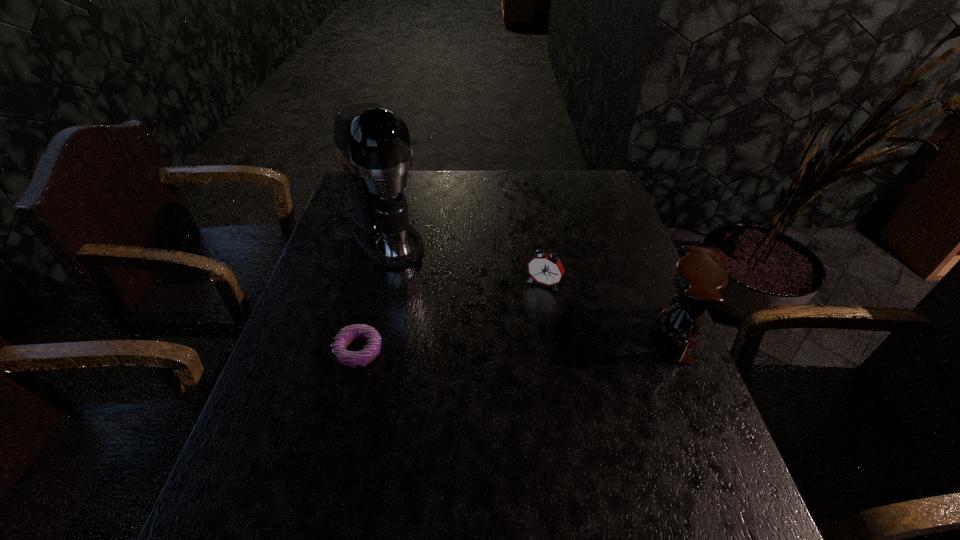
Image resolution: width=960 pixels, height=540 pixels. Identify the location of vacant space at the right edge of the desktop. (641, 420).

At what (x,y) coordinates should I click in order to perform the action: click on vacant space at the far right corner of the desktop. Please return your answer as a coordinate pair (x, y). Looking at the image, I should click on (616, 200).

This screenshot has height=540, width=960. What are the coordinates of `empty space between the third nearest object and the third shortest object` in the screenshot? It's located at coord(609,310).

Identify the location of vacant space that is in between the rightmost object and the shortest object. (516, 343).

The height and width of the screenshot is (540, 960). Identify the location of vacant point located between the coffee maker and the hourglass. (531, 288).

Locate an element on the screen. This screenshot has height=540, width=960. free space between the rightmost object and the tallest object is located at coordinates (531, 288).

Where is `free space that is in between the rightmost object and the farthest object`? The width and height of the screenshot is (960, 540). free space that is in between the rightmost object and the farthest object is located at coordinates (531, 288).

The height and width of the screenshot is (540, 960). I want to click on empty space that is in between the doughnut and the hourglass, so click(516, 343).

Image resolution: width=960 pixels, height=540 pixels. I want to click on vacant region between the farthest object and the third object from left to right, so click(466, 262).

The width and height of the screenshot is (960, 540). Find the location of `free area in between the tallest object and the hourglass`. free area in between the tallest object and the hourglass is located at coordinates (531, 288).